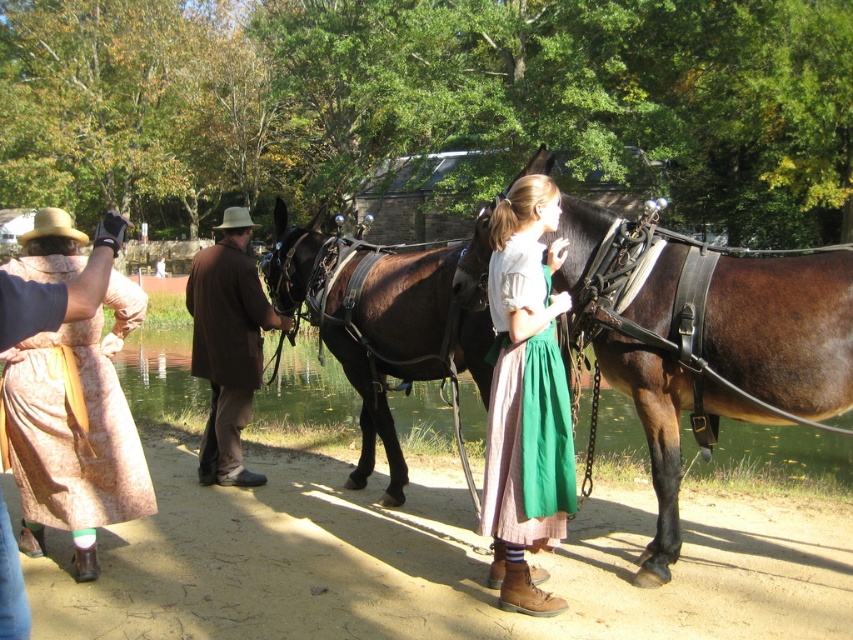
Question: Considering the relative positions of brown leather horse at center and patterned fabric dress at left in the image provided, where is brown leather horse at center located with respect to patterned fabric dress at left?

Choices:
 (A) right
 (B) left

Answer: (A)

Question: Which point appears farthest from the camera in this image?

Choices:
 (A) (790, 374)
 (B) (192, 326)
 (C) (10, 400)
 (D) (515, 538)

Answer: (B)

Question: Which point appears closest to the camera in this image?

Choices:
 (A) (503, 294)
 (B) (469, 266)

Answer: (A)

Question: Which object appears closest to the camera in this image?

Choices:
 (A) brown leather horse at center
 (B) green cotton skirt at center

Answer: (B)

Question: Is brown leather horse at center positioned behind brown leather coach at center?

Choices:
 (A) no
 (B) yes

Answer: (A)

Question: Can you confirm if brown leather horse at center is smaller than green cotton skirt at center?

Choices:
 (A) yes
 (B) no

Answer: (A)